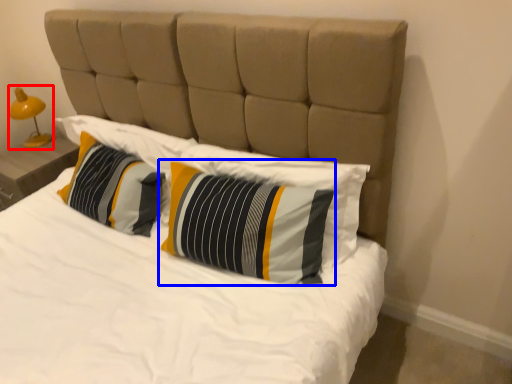
Question: Which point is closer to the camera, bedside lamp (highlighted by a red box) or pillow (highlighted by a blue box)?

Choices:
 (A) bedside lamp
 (B) pillow

Answer: (B)